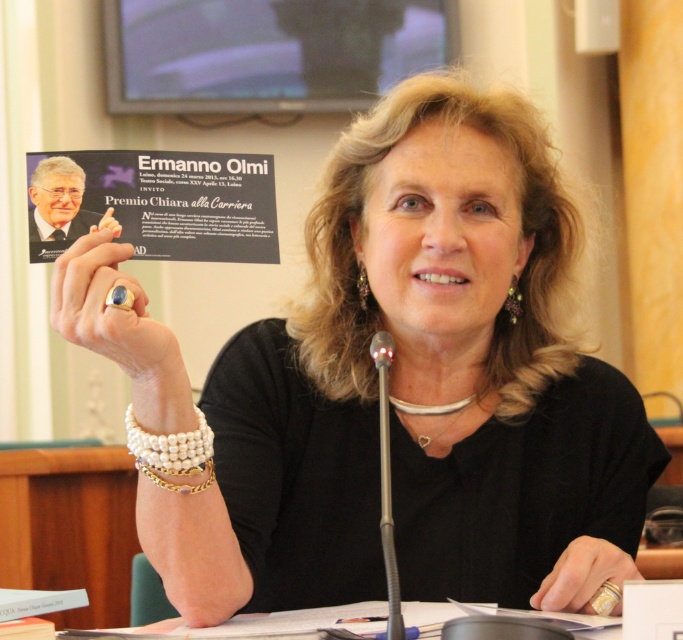
Question: Is gold ring at center to the left of pearl/leather bracelet at upper center from the viewer's perspective?

Choices:
 (A) no
 (B) yes

Answer: (B)

Question: Does gold ring at center appear under pearl/leather bracelet at upper center?

Choices:
 (A) no
 (B) yes

Answer: (A)

Question: Can you confirm if gold ring at lower right is smaller than black plastic microphone at center?

Choices:
 (A) yes
 (B) no

Answer: (A)

Question: Among these points, which one is farthest from the camera?

Choices:
 (A) (158, 477)
 (B) (176, 474)

Answer: (A)

Question: Which of these objects is positioned farthest from the pearl/leather bracelet at upper center?

Choices:
 (A) gold/pearl bracelet at upper center
 (B) black plastic microphone at center

Answer: (B)

Question: Which point is closer to the camera taking this photo?

Choices:
 (A) (137, 320)
 (B) (206, 468)
 (C) (180, 436)

Answer: (A)